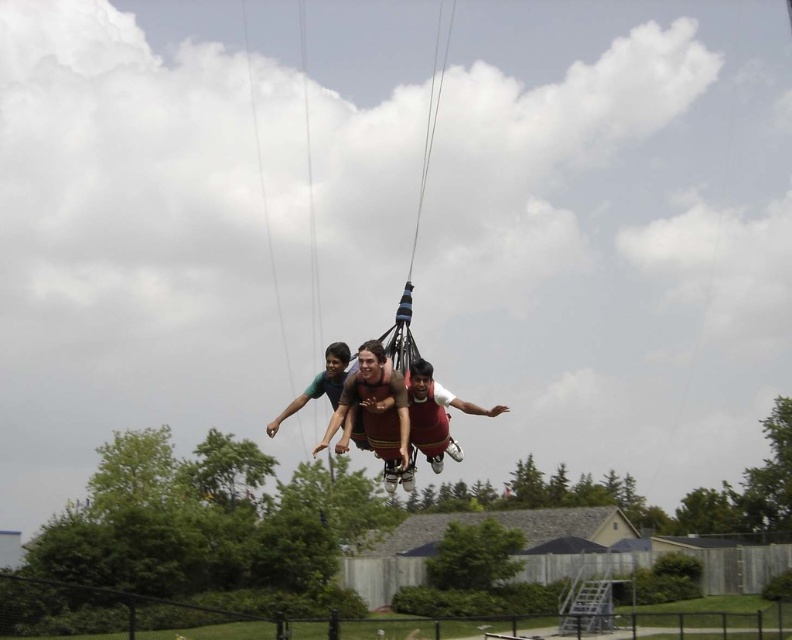
You are a safety inspector assessing the setup for a bungee jumping event. You need to ensure that the brown fabric swing at center is positioned at least 20 meters away from the camera for safety regulations. Based on the image provided, does the current setup comply with the safety distance requirement?

The brown fabric swing at center is 18.10 meters away from the camera, which is less than the required 20 meters. Therefore, the current setup does not comply with the safety distance requirement.